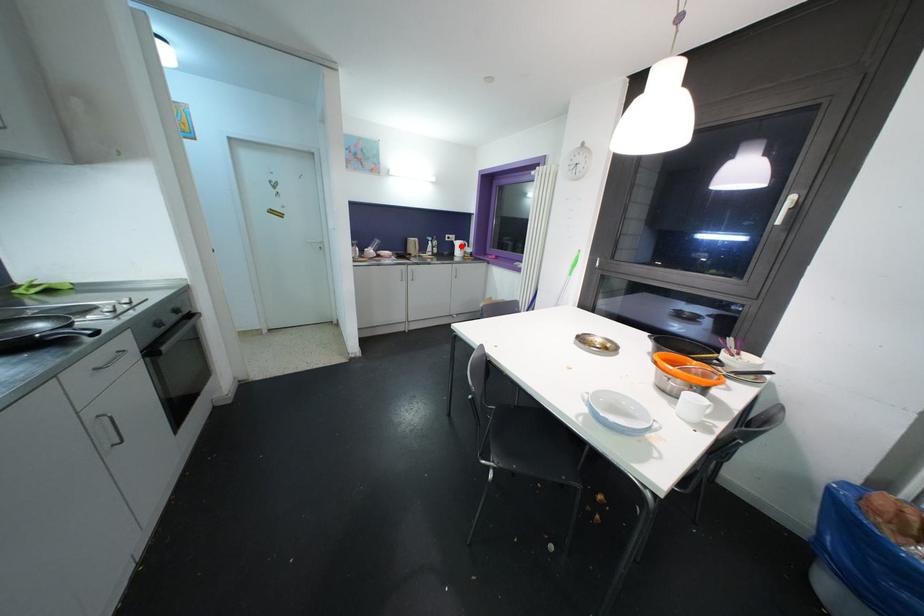
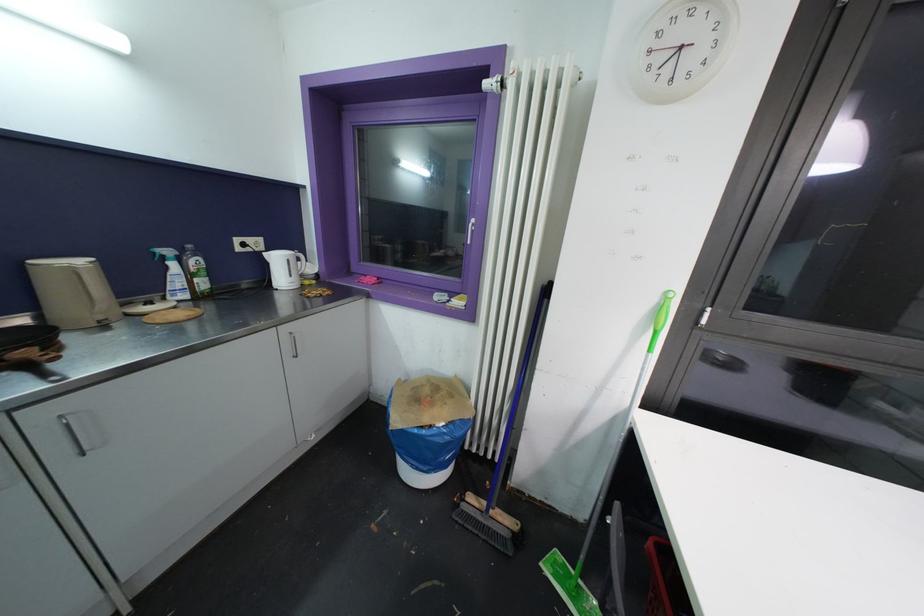
Question: I am providing you with two images of the same scene from different viewpoints. Given a red point in image1, look at the same physical point in image2. Is it:

Choices:
 (A) Closer to the viewpoint
 (B) Farther from the viewpoint

Answer: (B)